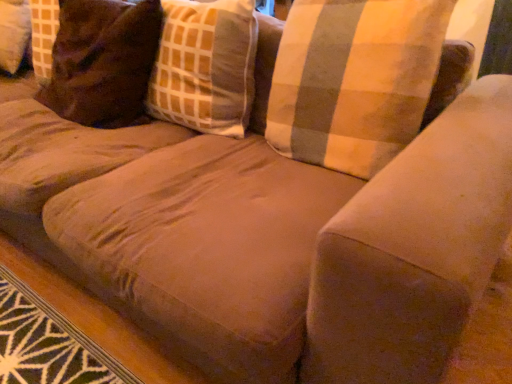
Image resolution: width=512 pixels, height=384 pixels. I want to click on plaid fabric pillow at center, so click(x=205, y=66).

From a real-world perspective, between plaid fabric pillow at upper right, the 1th pillow positioned from the right, and brown suede pillow at upper left, which is the second pillow from right to left, who is vertically lower?

brown suede pillow at upper left, which is the second pillow from right to left, is physically lower.

Is plaid fabric pillow at upper right, placed as the second pillow when sorted from left to right, oriented away from brown suede pillow at upper left, which is the second pillow from right to left?

No, plaid fabric pillow at upper right, placed as the second pillow when sorted from left to right, is not facing away from brown suede pillow at upper left, which is the second pillow from right to left.

Is point (321, 129) closer to viewer compared to point (143, 30)?

That is True.

Which is more to the right, brown suede pillow at upper left, positioned as the first pillow in left-to-right order, or plaid fabric pillow at upper right, placed as the second pillow when sorted from left to right?

plaid fabric pillow at upper right, placed as the second pillow when sorted from left to right, is more to the right.

Looking at this image, considering the sizes of objects brown suede pillow at upper left, which is the second pillow from right to left, and plaid fabric pillow at upper right, placed as the second pillow when sorted from left to right, in the image provided, who is taller, brown suede pillow at upper left, which is the second pillow from right to left, or plaid fabric pillow at upper right, placed as the second pillow when sorted from left to right,?

With more height is brown suede pillow at upper left, which is the second pillow from right to left.

Consider the image. Measure the distance from brown suede pillow at upper left, positioned as the first pillow in left-to-right order, to plaid fabric pillow at upper right, the 1th pillow positioned from the right.

brown suede pillow at upper left, positioned as the first pillow in left-to-right order, and plaid fabric pillow at upper right, the 1th pillow positioned from the right, are 72.39 centimeters apart from each other.

Do you think brown suede pillow at upper left, positioned as the first pillow in left-to-right order, is within plaid fabric pillow at upper right, the 1th pillow positioned from the right, or outside of it?

brown suede pillow at upper left, positioned as the first pillow in left-to-right order, is outside plaid fabric pillow at upper right, the 1th pillow positioned from the right.

Considering the sizes of objects plaid fabric pillow at upper right, the 1th pillow positioned from the right, and plaid fabric pillow at center in the image provided, who is wider, plaid fabric pillow at upper right, the 1th pillow positioned from the right, or plaid fabric pillow at center?

With larger width is plaid fabric pillow at upper right, the 1th pillow positioned from the right.

From the image's perspective, relative to plaid fabric pillow at center, is plaid fabric pillow at upper right, placed as the second pillow when sorted from left to right, above or below?

plaid fabric pillow at upper right, placed as the second pillow when sorted from left to right, is situated lower than plaid fabric pillow at center in the image.

Is plaid fabric pillow at upper right, placed as the second pillow when sorted from left to right, positioned beyond the bounds of plaid fabric pillow at center?

Absolutely, plaid fabric pillow at upper right, placed as the second pillow when sorted from left to right, is external to plaid fabric pillow at center.

Where is `pillow above the plaid fabric pillow at center (from a real-world perspective)`? The width and height of the screenshot is (512, 384). pillow above the plaid fabric pillow at center (from a real-world perspective) is located at coordinates (354, 80).

Does plaid fabric pillow at center turn towards plaid fabric pillow at upper right, placed as the second pillow when sorted from left to right?

No, plaid fabric pillow at center is not oriented towards plaid fabric pillow at upper right, placed as the second pillow when sorted from left to right.

From the image's perspective, relative to plaid fabric pillow at upper right, the 1th pillow positioned from the right, is plaid fabric pillow at center above or below?

plaid fabric pillow at center is above plaid fabric pillow at upper right, the 1th pillow positioned from the right.

Considering the sizes of objects plaid fabric pillow at center and plaid fabric pillow at upper right, the 1th pillow positioned from the right, in the image provided, who is taller, plaid fabric pillow at center or plaid fabric pillow at upper right, the 1th pillow positioned from the right,?

plaid fabric pillow at center.

Does plaid fabric pillow at center lie in front of plaid fabric pillow at upper right, placed as the second pillow when sorted from left to right?

No.

Is plaid fabric pillow at center bigger or smaller than brown suede pillow at upper left, positioned as the first pillow in left-to-right order?

In the image, plaid fabric pillow at center appears to be smaller than brown suede pillow at upper left, positioned as the first pillow in left-to-right order.

Could you measure the distance between plaid fabric pillow at center and brown suede pillow at upper left, positioned as the first pillow in left-to-right order?

8.38 inches.

Is plaid fabric pillow at center completely or partially outside of brown suede pillow at upper left, positioned as the first pillow in left-to-right order?

Yes.

Locate an element on the screen. This screenshot has height=384, width=512. throw pillow that appears above the brown suede pillow at upper left, which is the second pillow from right to left (from a real-world perspective) is located at coordinates (205, 66).

How many degrees apart are the facing directions of brown suede pillow at upper left, positioned as the first pillow in left-to-right order, and plaid fabric pillow at center?

The angle between the facing direction of brown suede pillow at upper left, positioned as the first pillow in left-to-right order, and the facing direction of plaid fabric pillow at center is 5.94 degrees.

From the image's perspective, which is below, brown suede pillow at upper left, which is the second pillow from right to left, or plaid fabric pillow at center?

plaid fabric pillow at center.

Looking at this image, does brown suede pillow at upper left, which is the second pillow from right to left, have a larger size compared to plaid fabric pillow at center?

Yes, brown suede pillow at upper left, which is the second pillow from right to left, is bigger than plaid fabric pillow at center.

At what (x,y) coordinates should I click in order to perform the action: click on pillow behind the plaid fabric pillow at upper right, the 1th pillow positioned from the right. Please return your answer as a coordinate pair (x, y). The image size is (512, 384). Looking at the image, I should click on (102, 61).

In order to click on pillow that is above the brown suede pillow at upper left, positioned as the first pillow in left-to-right order (from a real-world perspective) in this screenshot , I will do `click(354, 80)`.

From the image, which object appears to be farther from brown suede pillow at upper left, positioned as the first pillow in left-to-right order, plaid fabric pillow at center or plaid fabric pillow at upper right, the 1th pillow positioned from the right?

Among the two, plaid fabric pillow at upper right, the 1th pillow positioned from the right, is located further to brown suede pillow at upper left, positioned as the first pillow in left-to-right order.

Considering their positions, is plaid fabric pillow at center positioned further to plaid fabric pillow at upper right, the 1th pillow positioned from the right, than brown suede pillow at upper left, positioned as the first pillow in left-to-right order?

The object further to plaid fabric pillow at upper right, the 1th pillow positioned from the right, is brown suede pillow at upper left, positioned as the first pillow in left-to-right order.

Considering their positions, is plaid fabric pillow at upper right, placed as the second pillow when sorted from left to right, positioned closer to brown suede pillow at upper left, which is the second pillow from right to left, than plaid fabric pillow at center?

Among the two, plaid fabric pillow at center is located nearer to brown suede pillow at upper left, which is the second pillow from right to left.

Based on their spatial positions, is plaid fabric pillow at upper right, placed as the second pillow when sorted from left to right, or brown suede pillow at upper left, positioned as the first pillow in left-to-right order, closer to plaid fabric pillow at center?

brown suede pillow at upper left, positioned as the first pillow in left-to-right order, is positioned closer to the anchor plaid fabric pillow at center.

Based on their spatial positions, is brown suede pillow at upper left, positioned as the first pillow in left-to-right order, or plaid fabric pillow at center closer to plaid fabric pillow at upper right, the 1th pillow positioned from the right?

The object closer to plaid fabric pillow at upper right, the 1th pillow positioned from the right, is plaid fabric pillow at center.

Based on their spatial positions, is brown suede pillow at upper left, which is the second pillow from right to left, or plaid fabric pillow at upper right, placed as the second pillow when sorted from left to right, further from plaid fabric pillow at center?

plaid fabric pillow at upper right, placed as the second pillow when sorted from left to right.

Image resolution: width=512 pixels, height=384 pixels. I want to click on throw pillow between brown suede pillow at upper left, positioned as the first pillow in left-to-right order, and plaid fabric pillow at upper right, placed as the second pillow when sorted from left to right, so click(205, 66).